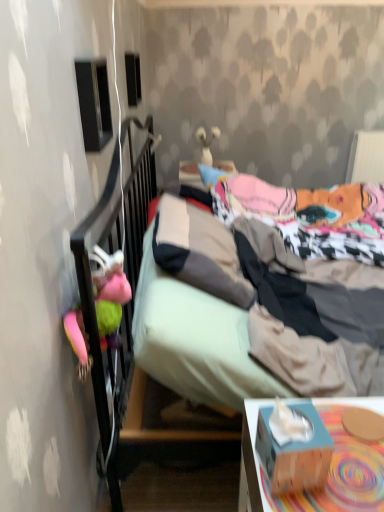
At what (x,y) coordinates should I click in order to perform the action: click on vacant area on top of wooden tissue box at lower right (from a real-world perspective). Please return your answer as a coordinate pair (x, y). Looking at the image, I should click on (354, 439).